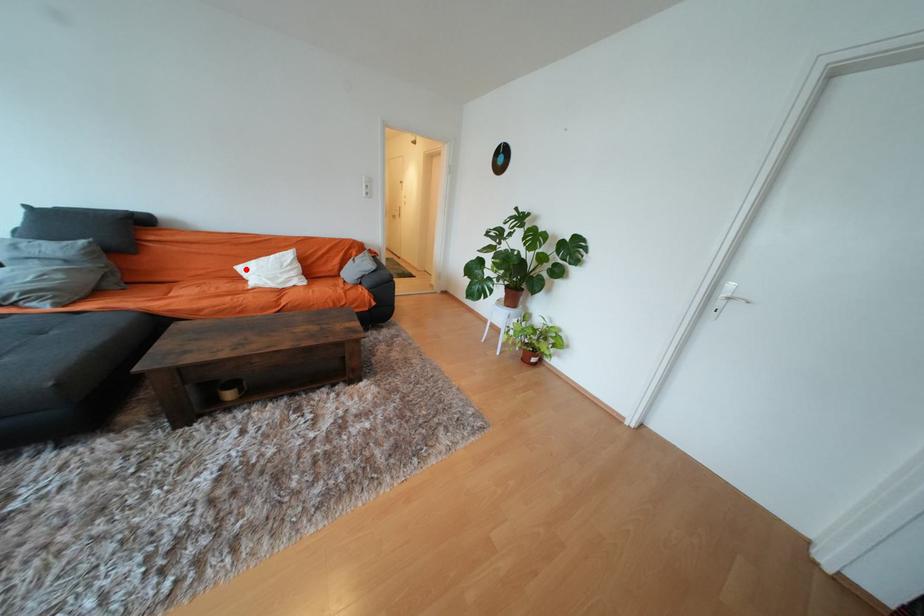
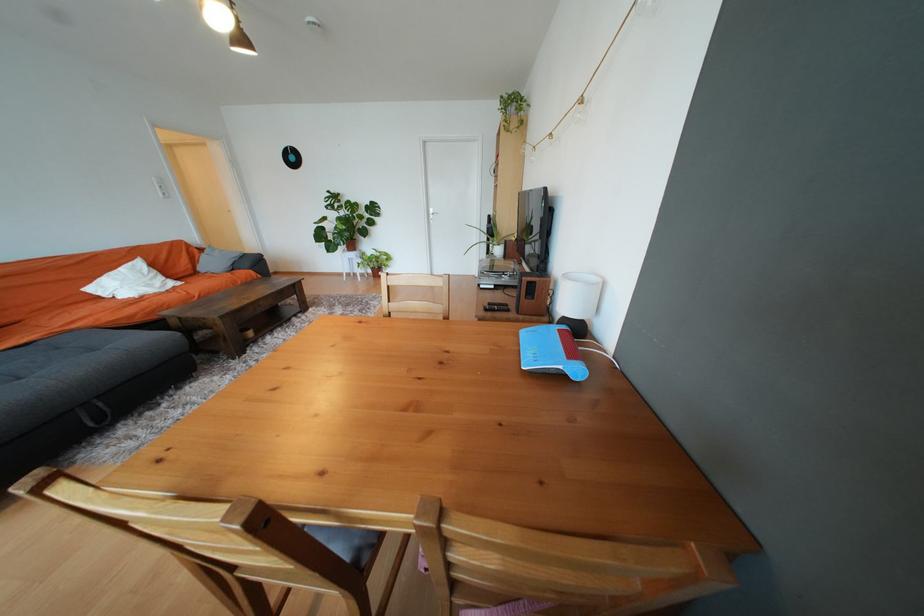
Question: I am providing you with two images of the same scene from different viewpoints. Given a red point in image1, look at the same physical point in image2. Is it:

Choices:
 (A) Closer to the viewpoint
 (B) Farther from the viewpoint

Answer: (B)